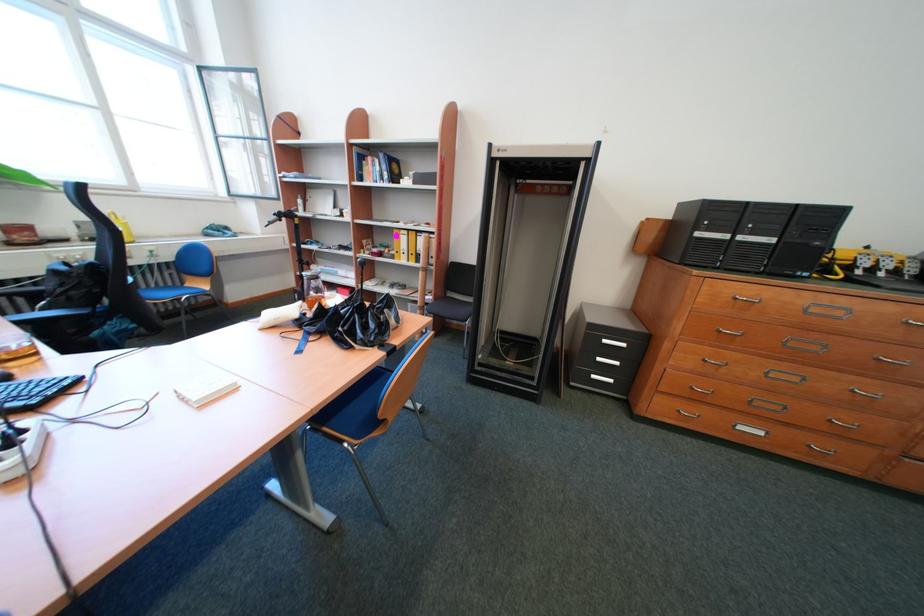
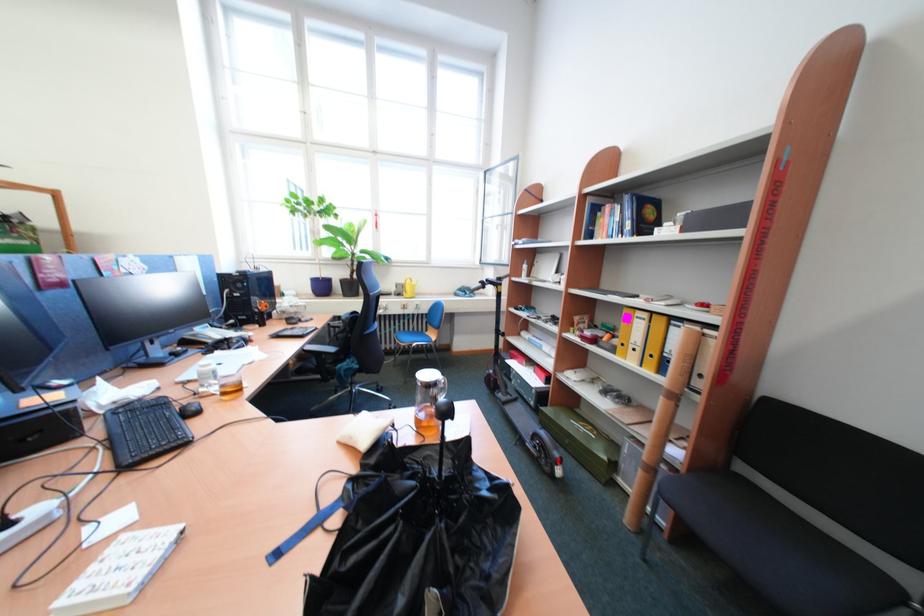
Locate, in the second image, the point that corresponds to the point at 271,206 in the first image.

(508, 272)